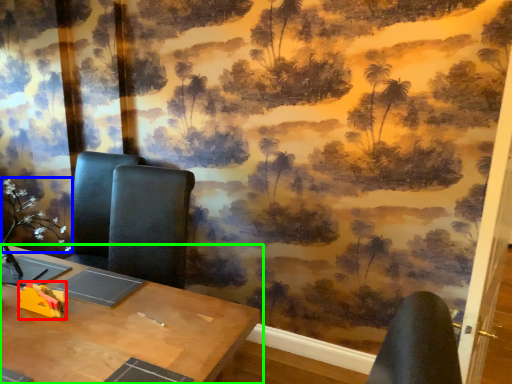
Question: Considering the real-world distances, which object is closest to toy (highlighted by a red box)? flower (highlighted by a blue box) or table (highlighted by a green box).

Choices:
 (A) flower
 (B) table

Answer: (B)